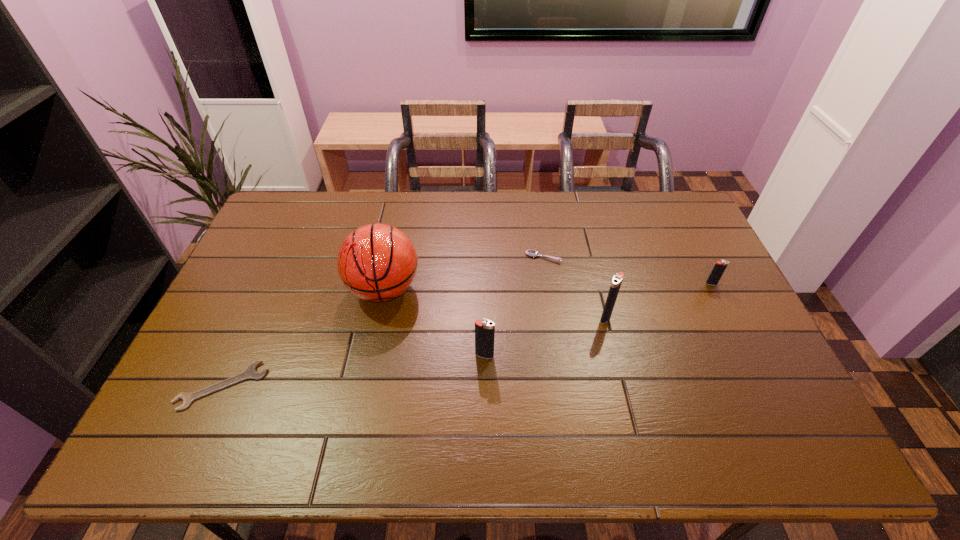
I want to click on igniter that stands as the second closest to the fifth tallest object, so click(484, 330).

Identify which igniter is located as the nearest to the fourth shortest object. Please provide its 2D coordinates. Your answer should be formatted as a tuple, i.e. [(x, y)], where the tuple contains the x and y coordinates of a point satisfying the conditions above.

[(616, 283)]

This screenshot has height=540, width=960. Find the location of `vacant point that satisfies the following two spatial constraints: 1. on the side with spill of the second igniter from right to left; 2. on the left side of the basketball`. vacant point that satisfies the following two spatial constraints: 1. on the side with spill of the second igniter from right to left; 2. on the left side of the basketball is located at coordinates (378, 317).

At what (x,y) coordinates should I click in order to perform the action: click on free space that satisfies the following two spatial constraints: 1. on the back side of the wrench; 2. on the right side of the third object from right to left. Please return your answer as a coordinate pair (x, y). This screenshot has width=960, height=540. Looking at the image, I should click on (281, 257).

The height and width of the screenshot is (540, 960). What are the coordinates of `vacant space that satisfies the following two spatial constraints: 1. on the side with spill of the second nearest object; 2. on the left side of the tallest object` in the screenshot? It's located at (371, 355).